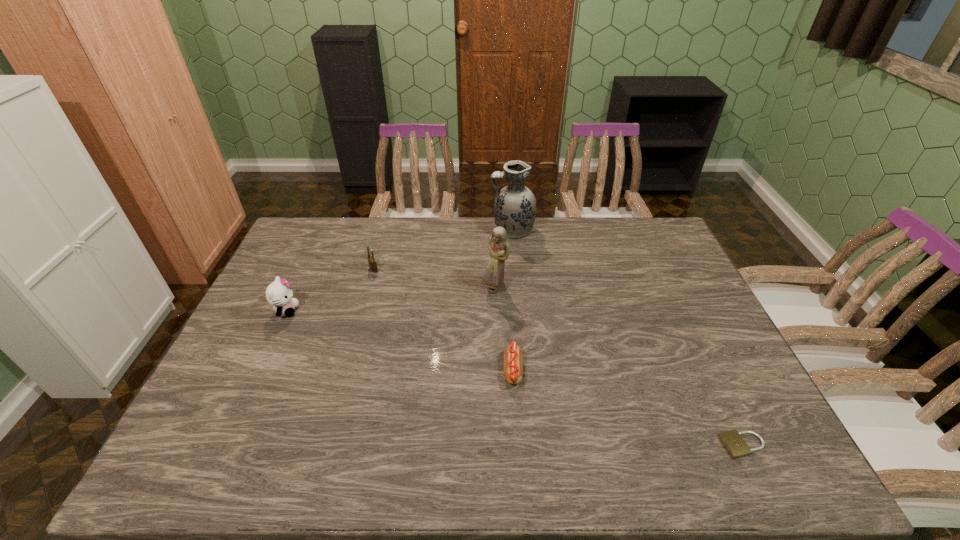
I want to click on vase, so 515,205.

Where is `figurine`? figurine is located at coordinates (498, 248).

Identify the location of kitten. (279, 294).

Where is `the leftmost object`? The width and height of the screenshot is (960, 540). the leftmost object is located at coordinates (279, 294).

At what (x,y) coordinates should I click in order to perform the action: click on the taller padlock. Please return your answer as a coordinate pair (x, y). Looking at the image, I should click on (372, 262).

Locate an element on the screen. This screenshot has height=540, width=960. the left padlock is located at coordinates (372, 262).

Identify the location of sausage. (513, 368).

The height and width of the screenshot is (540, 960). In order to click on the fifth tallest object in this screenshot , I will do [513, 368].

Identify the location of the shorter padlock. Image resolution: width=960 pixels, height=540 pixels. (733, 442).

Locate an element on the screen. the shortest object is located at coordinates (733, 442).